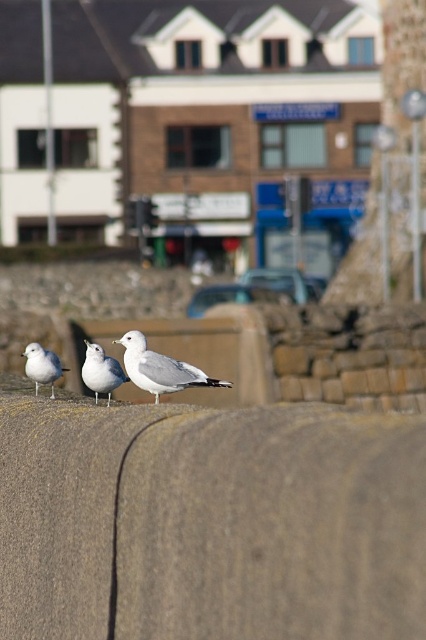
The height and width of the screenshot is (640, 426). Find the location of `gray concrete wall at center`. gray concrete wall at center is located at coordinates 210,522.

Is gray concrete wall at center bigger than white matte seagull at left?

Indeed, gray concrete wall at center has a larger size compared to white matte seagull at left.

Which is in front, point (333, 544) or point (32, 376)?

Point (333, 544) is in front.

I want to click on gray concrete wall at center, so click(210, 522).

Which is in front, point (13, 461) or point (100, 380)?

Point (13, 461)

Does gray concrete wall at center have a lesser height compared to white matte seagull at center?

No, gray concrete wall at center is not shorter than white matte seagull at center.

Describe the element at coordinates (210, 522) in the screenshot. The width and height of the screenshot is (426, 640). I see `gray concrete wall at center` at that location.

Identify the location of gray concrete wall at center. This screenshot has height=640, width=426. (210, 522).

Does white matte seagull at center have a lesser width compared to white matte seagull at left?

Yes, white matte seagull at center is thinner than white matte seagull at left.

Does point (89, 380) come closer to viewer compared to point (51, 352)?

That is True.

This screenshot has height=640, width=426. Identify the location of white matte seagull at center. (100, 371).